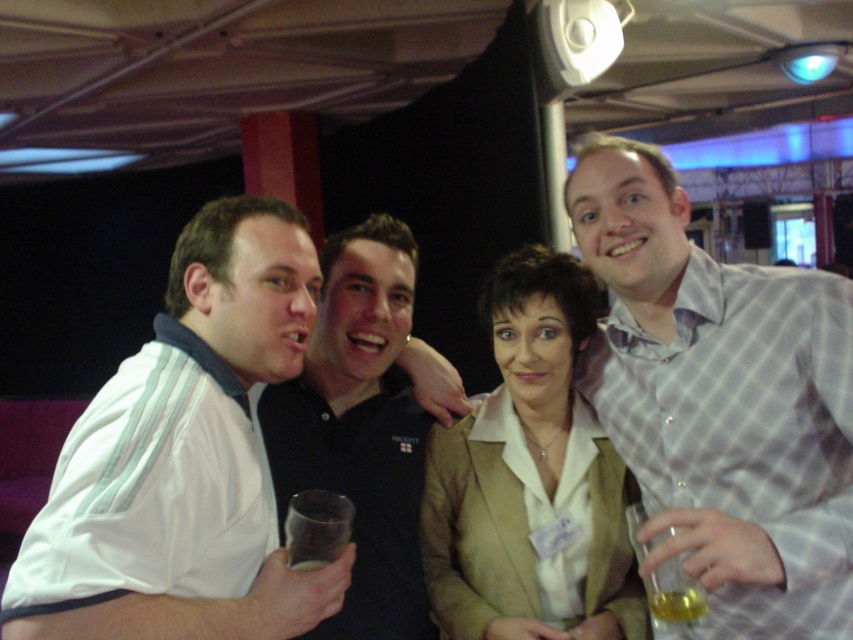
You are a photographer at a social event and need to adjust the camera focus. The light gray checkered shirt at upper right and the black matte shirt at center are both in the frame. Given that your camera has a depth of field that can cover up to 18 inches, will both subjects be in focus?

The distance between the light gray checkered shirt at upper right and the black matte shirt at center is 17.73 inches, which is within the camera s 18 inch depth of field. Therefore, both subjects will be in focus.

You are a photographer trying to capture a group photo of the beige fabric jacket at center and the man on the far left. If you want to ensure both subjects are in focus, and your camera has a depth of field that can cover 4.5 feet, will you be able to capture both subjects clearly?

The beige fabric jacket at center and the man on the far left are 4.49 feet apart, so yes, the camera can capture both subjects clearly since the distance is within the 4.5 feet depth of field.